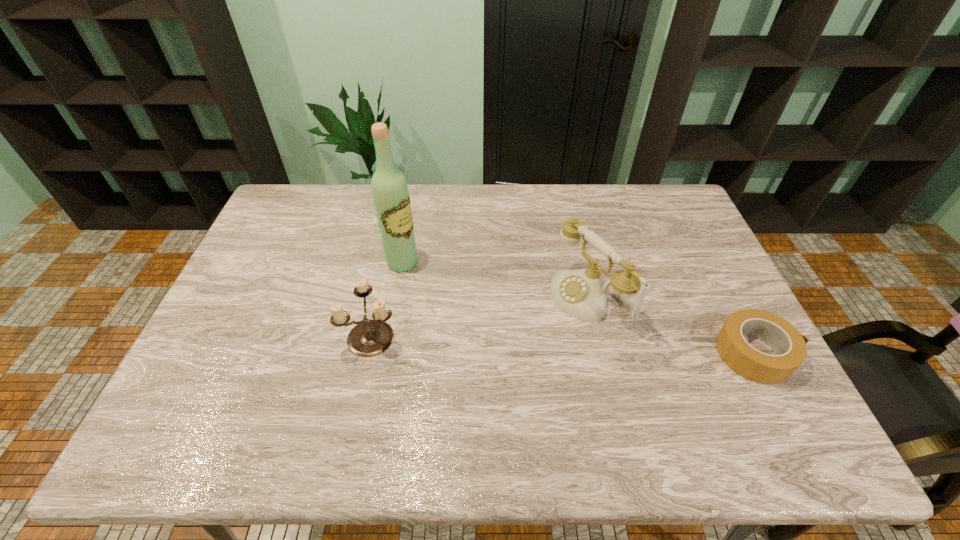
This screenshot has height=540, width=960. Identify the location of vacant space on the desktop that is between the candle holder and the duct tape and is positioned on the dial of the telephone. (504, 341).

Locate an element on the screen. The image size is (960, 540). free space on the desktop that is between the candle holder and the rightmost object and is positioned on the front-facing side of the tallest object is located at coordinates (532, 342).